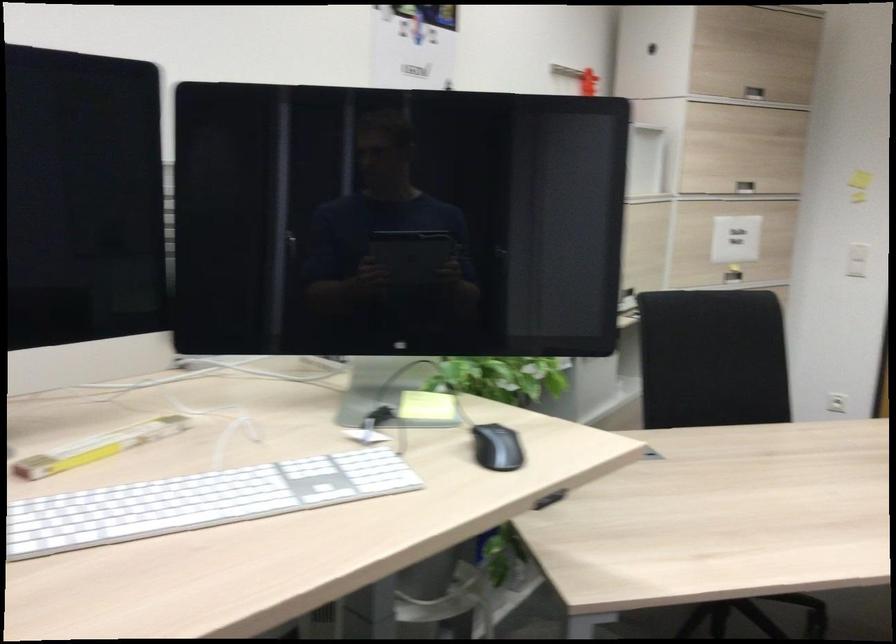
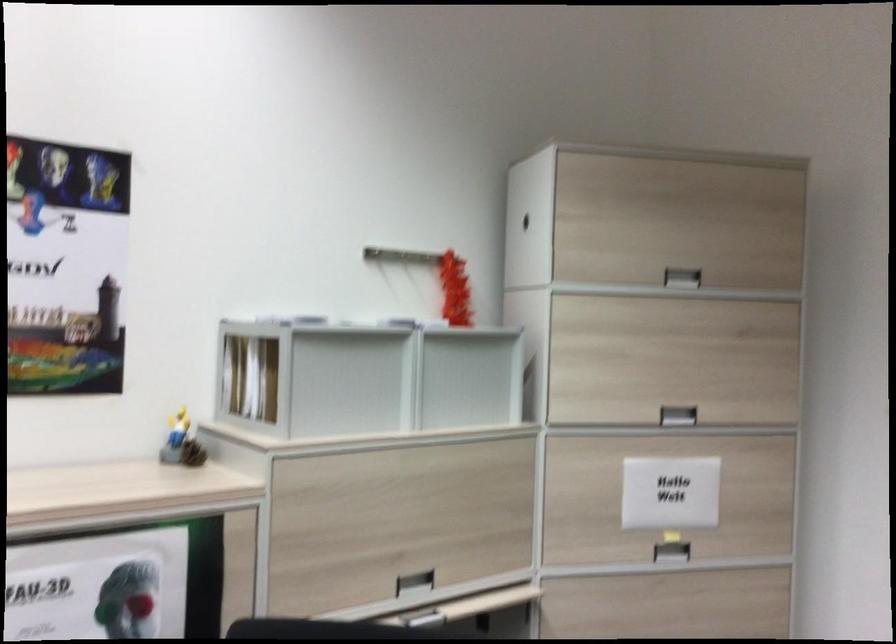
Locate, in the second image, the point that corresponds to (x=742, y=277) in the first image.

(670, 552)